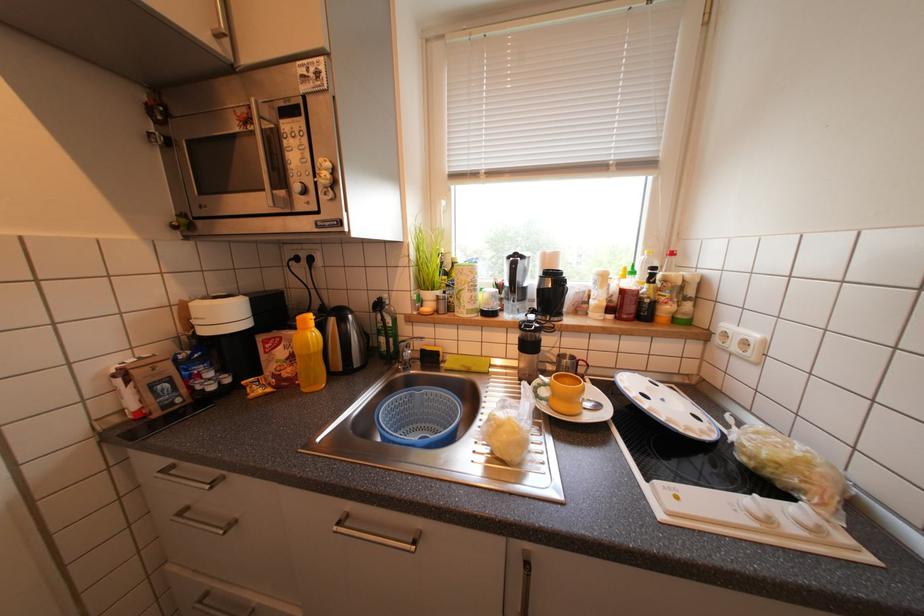
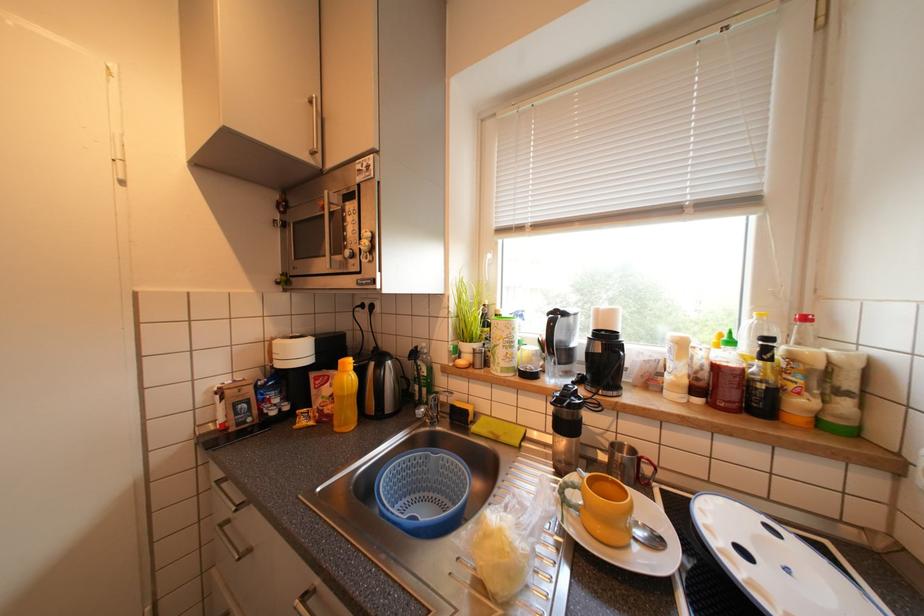
The images are taken continuously from a first-person perspective. In which direction are you moving?

The cameraman walked toward right, forward.